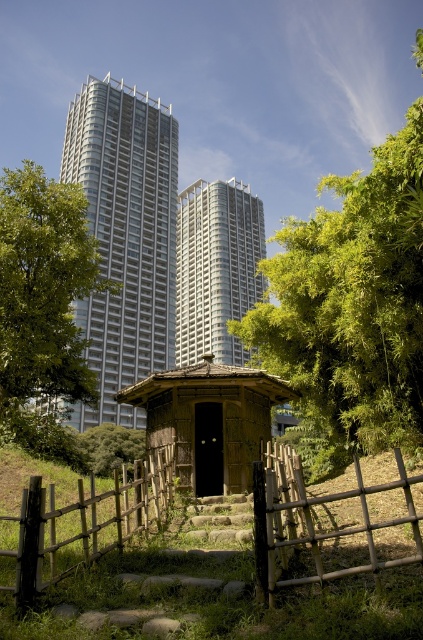
Does wooden rustic gate at center appear on the left side of green leafy tree at left?

No, wooden rustic gate at center is not to the left of green leafy tree at left.

Is wooden rustic gate at center taller than green leafy tree at left?

Incorrect, wooden rustic gate at center's height is not larger of green leafy tree at left's.

Find the location of a particular element. The image size is (423, 640). wooden rustic gate at center is located at coordinates (79, 525).

Based on the photo, measure the distance between point (47, 397) and camera.

Point (47, 397) is 31.20 meters from camera.

Who is lower down, green leafy tree at left or wooden hut at center?

wooden hut at center

Is point (30, 330) behind point (255, 424)?

Yes, it is.

Locate an element on the screen. green leafy tree at left is located at coordinates (43, 305).

Which is behind, point (145, 180) or point (241, 262)?

Positioned behind is point (241, 262).

Where is `silver glass tower at center`? This screenshot has width=423, height=640. silver glass tower at center is located at coordinates pyautogui.click(x=123, y=237).